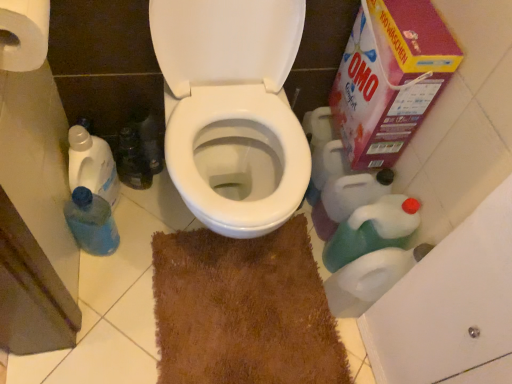
The image size is (512, 384). What do you see at coordinates (92, 165) in the screenshot?
I see `blue plastic bottle at left, the first cleaning product from the left` at bounding box center [92, 165].

Identify the location of blue plastic bottle at left, the first cleaning product from the left. The height and width of the screenshot is (384, 512). (92, 165).

The width and height of the screenshot is (512, 384). What do you see at coordinates (91, 222) in the screenshot?
I see `blue translucent bottle at lower left` at bounding box center [91, 222].

This screenshot has height=384, width=512. What do you see at coordinates (243, 310) in the screenshot?
I see `brown shaggy rug at center` at bounding box center [243, 310].

You are a GUI agent. You are given a task and a screenshot of the screen. Output one action in this format:
    pyautogui.click(x=<x>, y=<y>)
    Task: Click on the brown shaggy rug at center
    This screenshot has height=384, width=512.
    Given the screenshot: What is the action you would take?
    pyautogui.click(x=243, y=310)

Where is `white paper towel at upper left`? This screenshot has height=384, width=512. white paper towel at upper left is located at coordinates (25, 33).

Is blue translucent bottle at lower left positioned behind cardboard box at upper right?

Yes, the depth of blue translucent bottle at lower left is greater than that of cardboard box at upper right.

Can you confirm if blue translucent bottle at lower left is shorter than cardboard box at upper right?

Indeed, blue translucent bottle at lower left has a lesser height compared to cardboard box at upper right.

The image size is (512, 384). Identify the location of bottle that appears below the cardboard box at upper right (from a real-world perspective). (91, 222).

Would you say cardboard box at upper right is part of blue translucent bottle at lower left's contents?

No, cardboard box at upper right is not inside blue translucent bottle at lower left.

Is brown shaggy rug at center located outside green plastic bottle at lower right, which ranks as the first cleaning product in right-to-left order?

Absolutely, brown shaggy rug at center is external to green plastic bottle at lower right, which ranks as the first cleaning product in right-to-left order.

Is the position of brown shaggy rug at center less distant than that of green plastic bottle at lower right, which ranks as the second cleaning product in left-to-right order?

Yes, brown shaggy rug at center is in front of green plastic bottle at lower right, which ranks as the second cleaning product in left-to-right order.

Are brown shaggy rug at center and green plastic bottle at lower right, which ranks as the first cleaning product in right-to-left order, located far from each other?

No, brown shaggy rug at center is not far away from green plastic bottle at lower right, which ranks as the first cleaning product in right-to-left order.

Is blue translucent bottle at lower left positioned far away from green plastic bottle at lower right, which ranks as the first cleaning product in right-to-left order?

No, blue translucent bottle at lower left is in close proximity to green plastic bottle at lower right, which ranks as the first cleaning product in right-to-left order.

From the image's perspective, who appears lower, blue translucent bottle at lower left or green plastic bottle at lower right, which ranks as the first cleaning product in right-to-left order?

green plastic bottle at lower right, which ranks as the first cleaning product in right-to-left order, appears lower in the image.

Which object is further away from the camera taking this photo, blue translucent bottle at lower left or green plastic bottle at lower right, which ranks as the second cleaning product in left-to-right order?

Positioned behind is blue translucent bottle at lower left.

Considering the points (84, 208) and (367, 245), which point is in front, point (84, 208) or point (367, 245)?

The point (84, 208) is in front.

Is blue translucent bottle at lower left further to camera compared to white paper towel at upper left?

Yes, the depth of blue translucent bottle at lower left is greater than that of white paper towel at upper left.

Considering the sizes of objects blue translucent bottle at lower left and white paper towel at upper left in the image provided, who is wider, blue translucent bottle at lower left or white paper towel at upper left?

Wider between the two is white paper towel at upper left.

How far apart are blue translucent bottle at lower left and white paper towel at upper left?

The distance of blue translucent bottle at lower left from white paper towel at upper left is 56.10 centimeters.

Could you tell me if blue translucent bottle at lower left is facing white paper towel at upper left?

No, blue translucent bottle at lower left is not oriented towards white paper towel at upper left.

From the picture: Considering the sizes of objects white paper towel at upper left and cardboard box at upper right in the image provided, who is taller, white paper towel at upper left or cardboard box at upper right?

cardboard box at upper right.

From a real-world perspective, who is located lower, white paper towel at upper left or cardboard box at upper right?

In real-world perspective, cardboard box at upper right is lower.

Based on the photo, are white paper towel at upper left and cardboard box at upper right far apart?

white paper towel at upper left is near cardboard box at upper right, not far away.

Is white paper towel at upper left facing towards cardboard box at upper right?

Yes, white paper towel at upper left is turned towards cardboard box at upper right.

Is green plastic bottle at lower right, which ranks as the second cleaning product in left-to-right order, situated inside brown shaggy rug at center or outside?

green plastic bottle at lower right, which ranks as the second cleaning product in left-to-right order, lies outside brown shaggy rug at center.

Is green plastic bottle at lower right, which ranks as the first cleaning product in right-to-left order, turned away from brown shaggy rug at center?

That's not correct — green plastic bottle at lower right, which ranks as the first cleaning product in right-to-left order, is not looking away from brown shaggy rug at center.

What's the angular difference between green plastic bottle at lower right, which ranks as the second cleaning product in left-to-right order, and brown shaggy rug at center's facing directions?

The angular difference between green plastic bottle at lower right, which ranks as the second cleaning product in left-to-right order, and brown shaggy rug at center is 87.2 degrees.

From the picture: Does green plastic bottle at lower right, which ranks as the second cleaning product in left-to-right order, have a greater height compared to brown shaggy rug at center?

Yes.

Consider the image. From a real-world perspective, is cardboard box at upper right located higher than brown shaggy rug at center?

Yes, from a real-world perspective, cardboard box at upper right is over brown shaggy rug at center

Who is more distant, cardboard box at upper right or brown shaggy rug at center?

brown shaggy rug at center is more distant.

Based on their positions, is cardboard box at upper right located to the left or right of brown shaggy rug at center?

From the image, it's evident that cardboard box at upper right is to the right of brown shaggy rug at center.

Consider the image. Is cardboard box at upper right taller or shorter than brown shaggy rug at center?

cardboard box at upper right is taller than brown shaggy rug at center.

At what (x,y) coordinates should I click in order to perform the action: click on cardboard box in front of the blue translucent bottle at lower left. Please return your answer as a coordinate pair (x, y). Looking at the image, I should click on (390, 78).

Identify the location of doormat lying below the green plastic bottle at lower right, which ranks as the first cleaning product in right-to-left order (from the image's perspective). This screenshot has width=512, height=384. click(x=243, y=310).

From the picture: Which object lies nearer to the anchor point white paper towel at upper left, cardboard box at upper right or green plastic bottle at lower right, which ranks as the first cleaning product in right-to-left order?

cardboard box at upper right is positioned closer to the anchor white paper towel at upper left.

Looking at the image, which one is located further to green plastic bottle at lower right, which ranks as the second cleaning product in left-to-right order, brown shaggy rug at center or blue translucent bottle at lower left?

blue translucent bottle at lower left is further to green plastic bottle at lower right, which ranks as the second cleaning product in left-to-right order.

From the image, which object appears to be nearer to blue plastic bottle at left, the first cleaning product from the left, cardboard box at upper right or white paper towel at upper left?

white paper towel at upper left is closer to blue plastic bottle at left, the first cleaning product from the left.

Estimate the real-world distances between objects in this image. Which object is closer to green plastic bottle at lower right, which ranks as the first cleaning product in right-to-left order, blue plastic bottle at left, the 2th cleaning product from the right, or blue translucent bottle at lower left?

The object closer to green plastic bottle at lower right, which ranks as the first cleaning product in right-to-left order, is blue translucent bottle at lower left.

From the picture: Looking at the image, which one is located closer to green plastic bottle at lower right, which ranks as the first cleaning product in right-to-left order, blue plastic bottle at left, the 2th cleaning product from the right, or cardboard box at upper right?

cardboard box at upper right.

Considering their positions, is blue plastic bottle at left, the 2th cleaning product from the right, positioned closer to blue translucent bottle at lower left than white paper towel at upper left?

blue plastic bottle at left, the 2th cleaning product from the right.

Looking at the image, which one is located closer to blue plastic bottle at left, the 2th cleaning product from the right, cardboard box at upper right or brown shaggy rug at center?

brown shaggy rug at center lies closer to blue plastic bottle at left, the 2th cleaning product from the right, than the other object.

Based on their spatial positions, is green plastic bottle at lower right, which ranks as the second cleaning product in left-to-right order, or white paper towel at upper left closer to brown shaggy rug at center?

green plastic bottle at lower right, which ranks as the second cleaning product in left-to-right order.

This screenshot has width=512, height=384. Identify the location of bottle between blue plastic bottle at left, the first cleaning product from the left, and brown shaggy rug at center from left to right. (91, 222).

Image resolution: width=512 pixels, height=384 pixels. What are the coordinates of `bottle situated between blue plastic bottle at left, the first cleaning product from the left, and green plastic bottle at lower right, which ranks as the first cleaning product in right-to-left order, from left to right` in the screenshot? It's located at (91, 222).

Where is `doormat between blue translucent bottle at lower left and cardboard box at upper right in the horizontal direction`? The width and height of the screenshot is (512, 384). doormat between blue translucent bottle at lower left and cardboard box at upper right in the horizontal direction is located at coordinates (243, 310).

Identify the location of toilet paper situated between blue translucent bottle at lower left and green plastic bottle at lower right, which ranks as the second cleaning product in left-to-right order, from left to right. The width and height of the screenshot is (512, 384). (25, 33).